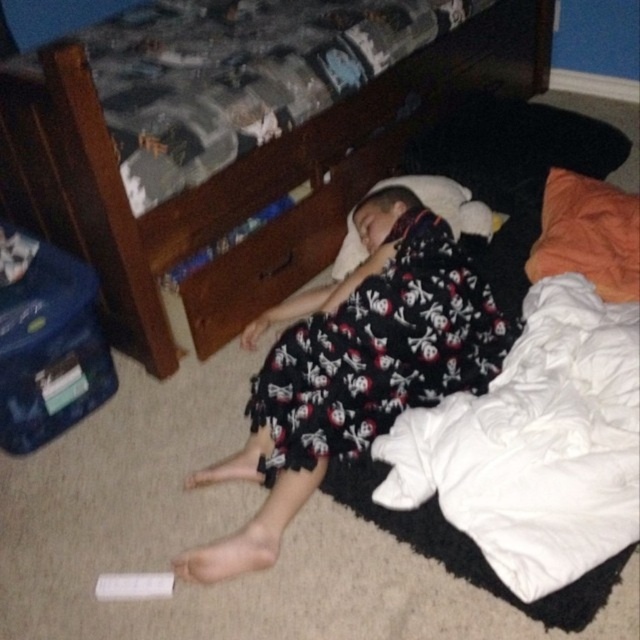
Question: Can you confirm if wooden drawer at center is positioned below white soft pillow at center?

Choices:
 (A) no
 (B) yes

Answer: (B)

Question: Does black cotton pajamas at center have a lesser width compared to white soft pillow at center?

Choices:
 (A) yes
 (B) no

Answer: (B)

Question: Which point is closer to the camera?

Choices:
 (A) black cotton pajamas at center
 (B) wooden bunk bed at upper center
 (C) white soft pillow at center
 (D) wooden drawer at center

Answer: (B)

Question: Which of these objects is positioned closest to the wooden bunk bed at upper center?

Choices:
 (A) black cotton pajamas at center
 (B) wooden drawer at center
 (C) white soft pillow at center

Answer: (B)

Question: Estimate the real-world distances between objects in this image. Which object is farther from the white soft pillow at center?

Choices:
 (A) black cotton pajamas at center
 (B) wooden bunk bed at upper center
 (C) wooden drawer at center

Answer: (B)

Question: Can you confirm if black cotton pajamas at center is positioned to the right of white soft pillow at center?

Choices:
 (A) yes
 (B) no

Answer: (B)